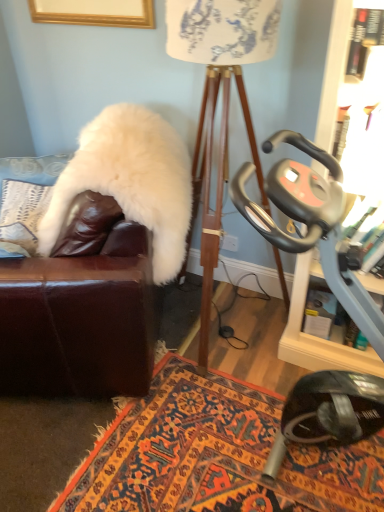
This screenshot has height=512, width=384. Identify the location of free spot below metallic gray stationary bike at right (from a real-world perspective). (300, 444).